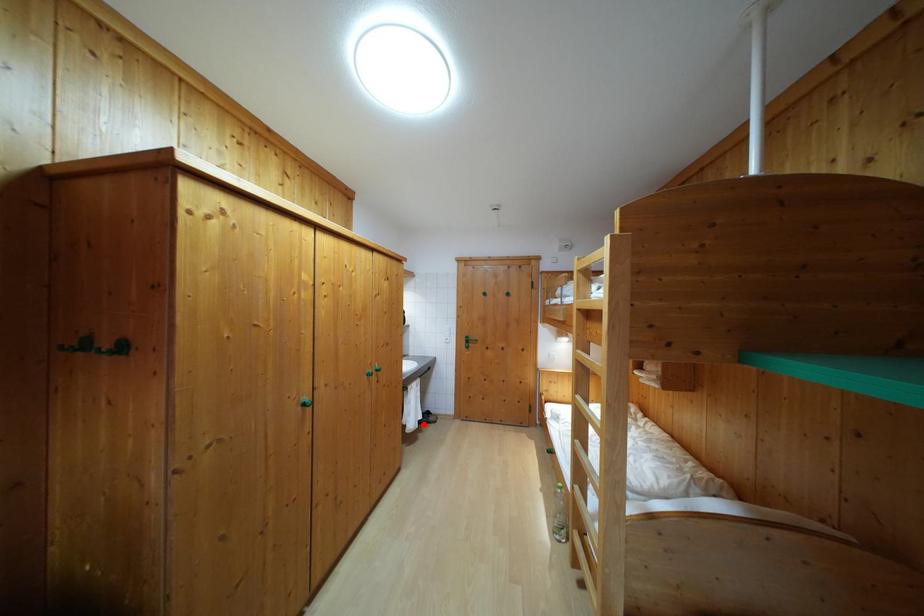
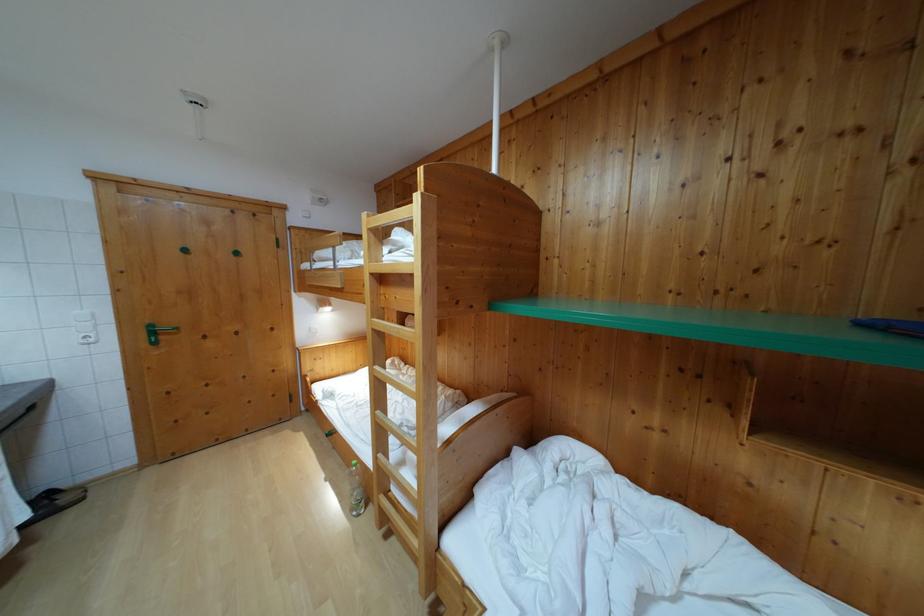
Question: I am providing you with two images of the same scene from different viewpoints. Image1 has a red point marked. In image2, the corresponding 3D location appears at what relative position? Reply with the corresponding letter.

Choices:
 (A) Closer
 (B) Farther

Answer: (B)